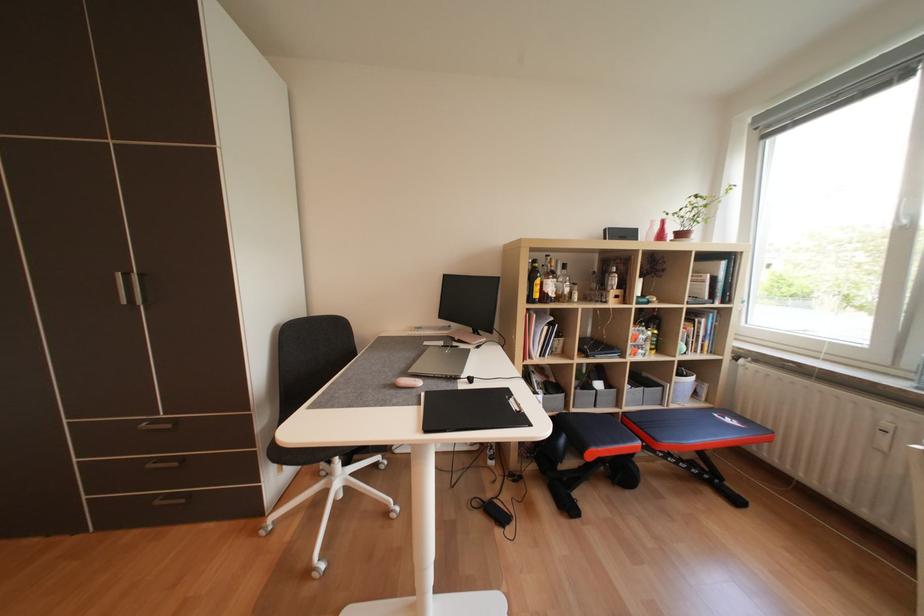
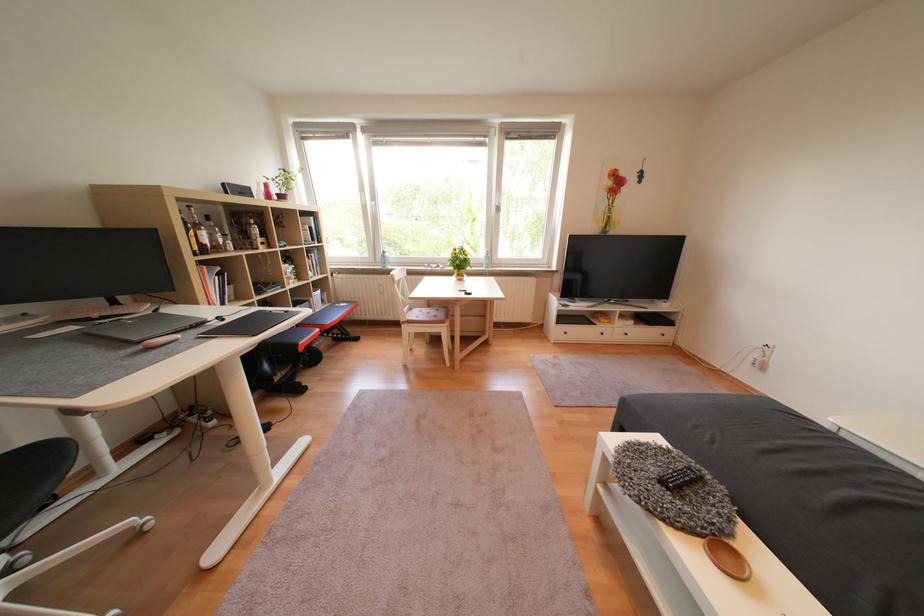
How did the camera likely rotate?

The rotation direction of the camera is right-down.